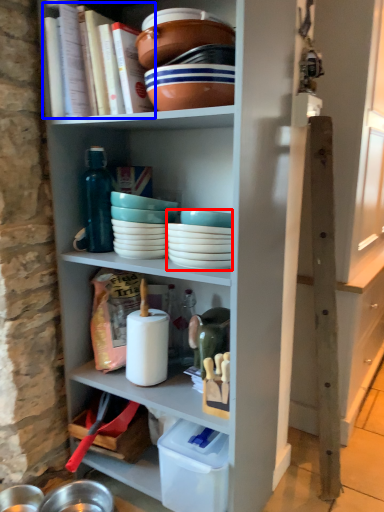
Question: Which point is further to the camera, tableware (highlighted by a red box) or book (highlighted by a blue box)?

Choices:
 (A) tableware
 (B) book

Answer: (A)